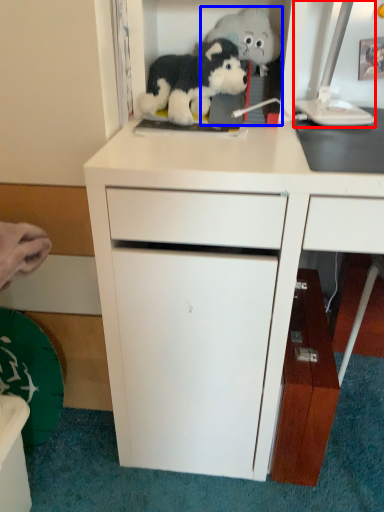
Question: Which object appears closest to the camera in this image, computer monitor (highlighted by a red box) or toy (highlighted by a blue box)?

Choices:
 (A) computer monitor
 (B) toy

Answer: (A)